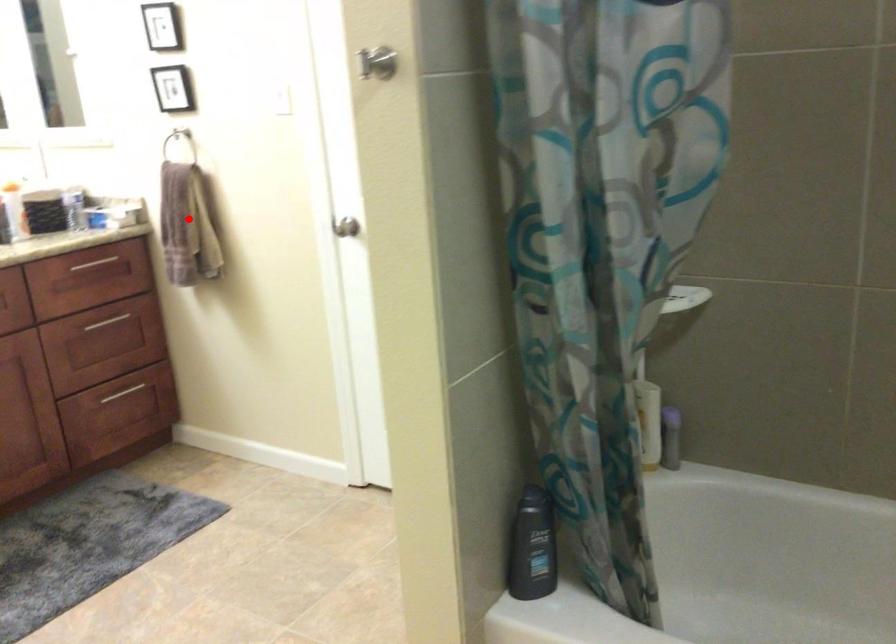
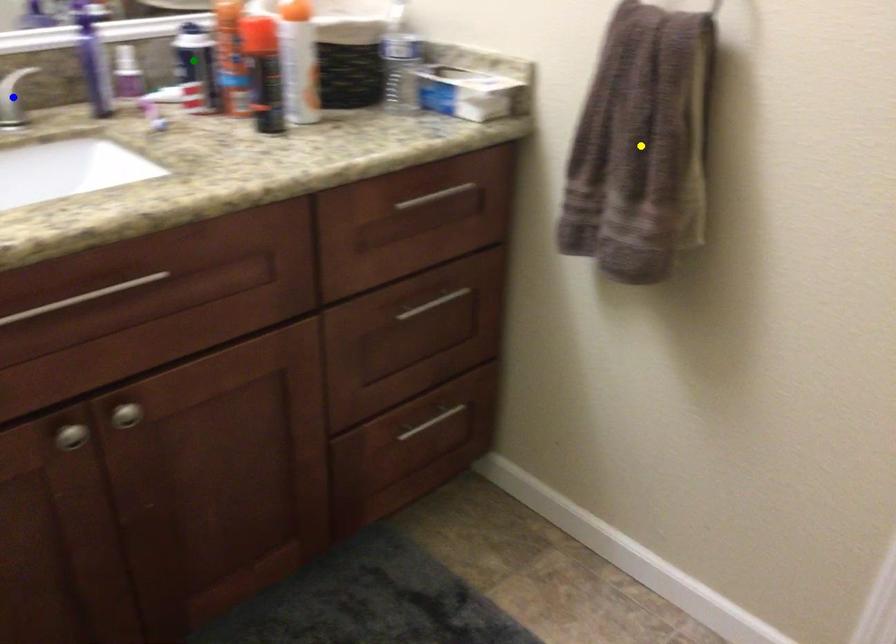
Question: I am providing you with two images of the same scene from different viewpoints. A red point is marked on the first image. You are given multiple points on the second image. Which point in image 2 is actually the same real-world point as the red point in image 1?

Choices:
 (A) yellow point
 (B) blue point
 (C) green point

Answer: (A)